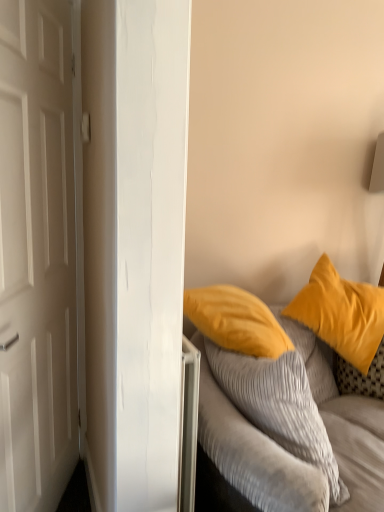
What is the approximate width of white matte door at left?

It is 7.10 inches.

You are a GUI agent. You are given a task and a screenshot of the screen. Output one action in this format:
    pyautogui.click(x=<x>, y=<y>)
    Task: Click on the soft yellow pillow at right
    
    Given the screenshot: What is the action you would take?
    pyautogui.click(x=250, y=446)

This screenshot has height=512, width=384. What do you see at coordinates (341, 313) in the screenshot?
I see `matte yellow pillow at upper right` at bounding box center [341, 313].

Where is `white matte door at left`? This screenshot has width=384, height=512. white matte door at left is located at coordinates (37, 256).

Is matte yellow pillow at upper right to the left of white matte door at left from the viewer's perspective?

In fact, matte yellow pillow at upper right is to the right of white matte door at left.

In the image, is matte yellow pillow at upper right positioned in front of or behind white matte door at left?

matte yellow pillow at upper right is behind white matte door at left.

Is point (349, 282) closer to camera compared to point (29, 177)?

No, it is not.

What's the angular difference between matte yellow pillow at upper right and white matte door at left's facing directions?

They differ by 99 degrees in their facing directions.

Who is shorter, matte yellow pillow at upper right or soft yellow pillow at right?

Standing shorter between the two is soft yellow pillow at right.

Is matte yellow pillow at upper right closer to the viewer compared to soft yellow pillow at right?

That is False.

Based on the photo, from a real-world perspective, is matte yellow pillow at upper right under soft yellow pillow at right?

Incorrect, from a real-world perspective, matte yellow pillow at upper right is higher than soft yellow pillow at right.

Is matte yellow pillow at upper right not near soft yellow pillow at right?

No, matte yellow pillow at upper right is in close proximity to soft yellow pillow at right.

Is soft yellow pillow at right in contact with matte yellow pillow at upper right?

No, soft yellow pillow at right is not making contact with matte yellow pillow at upper right.

In the image, there is a matte yellow pillow at upper right. Where is `studio couch below it (from a real-world perspective)`? studio couch below it (from a real-world perspective) is located at coordinates (250, 446).

From a real-world perspective, is soft yellow pillow at right positioned above or below matte yellow pillow at upper right?

From a real-world perspective, soft yellow pillow at right is physically below matte yellow pillow at upper right.

Is soft yellow pillow at right smaller than matte yellow pillow at upper right?

Indeed, soft yellow pillow at right has a smaller size compared to matte yellow pillow at upper right.

Would you say soft yellow pillow at right is inside or outside white matte door at left?

soft yellow pillow at right lies outside white matte door at left.

How distant is soft yellow pillow at right from white matte door at left?

soft yellow pillow at right and white matte door at left are 31.37 inches apart from each other.

From a real-world perspective, between soft yellow pillow at right and white matte door at left, who is vertically higher?

From a 3D spatial view, white matte door at left is above.

From the picture: In terms of width, does soft yellow pillow at right look wider or thinner when compared to white matte door at left?

Clearly, soft yellow pillow at right has more width compared to white matte door at left.

Consider the image. Can you confirm if white matte door at left is thinner than matte yellow pillow at upper right?

Yes.

From a real-world perspective, is white matte door at left positioned above or below matte yellow pillow at upper right?

white matte door at left is above matte yellow pillow at upper right.

Does white matte door at left turn towards matte yellow pillow at upper right?

No, white matte door at left is not aimed at matte yellow pillow at upper right.

Who is bigger, white matte door at left or soft yellow pillow at right?

Bigger between the two is white matte door at left.

From a real-world perspective, is white matte door at left located beneath soft yellow pillow at right?

Incorrect, from a real-world perspective, white matte door at left is higher than soft yellow pillow at right.

Would you say white matte door at left is inside or outside soft yellow pillow at right?

white matte door at left is located beyond the bounds of soft yellow pillow at right.

Considering the sizes of white matte door at left and soft yellow pillow at right in the image, is white matte door at left taller or shorter than soft yellow pillow at right?

In the image, white matte door at left appears to be taller than soft yellow pillow at right.

Locate an element on the screen. This screenshot has height=512, width=384. door above the matte yellow pillow at upper right (from a real-world perspective) is located at coordinates (37, 256).

I want to click on studio couch below the matte yellow pillow at upper right (from the image's perspective), so click(x=250, y=446).

Looking at the image, which one is located further to soft yellow pillow at right, matte yellow pillow at upper right or white matte door at left?

The object further to soft yellow pillow at right is white matte door at left.

Estimate the real-world distances between objects in this image. Which object is further from matte yellow pillow at upper right, white matte door at left or soft yellow pillow at right?

The object further to matte yellow pillow at upper right is white matte door at left.

Estimate the real-world distances between objects in this image. Which object is closer to matte yellow pillow at upper right, soft yellow pillow at right or white matte door at left?

soft yellow pillow at right lies closer to matte yellow pillow at upper right than the other object.

Based on their spatial positions, is matte yellow pillow at upper right or soft yellow pillow at right further from white matte door at left?

Among the two, matte yellow pillow at upper right is located further to white matte door at left.

Based on their spatial positions, is soft yellow pillow at right or matte yellow pillow at upper right closer to white matte door at left?

soft yellow pillow at right lies closer to white matte door at left than the other object.

Considering their positions, is white matte door at left positioned further to soft yellow pillow at right than matte yellow pillow at upper right?

white matte door at left.

At what (x,y) coordinates should I click in order to perform the action: click on studio couch between white matte door at left and matte yellow pillow at upper right in the horizontal direction. Please return your answer as a coordinate pair (x, y). The height and width of the screenshot is (512, 384). Looking at the image, I should click on [x=250, y=446].